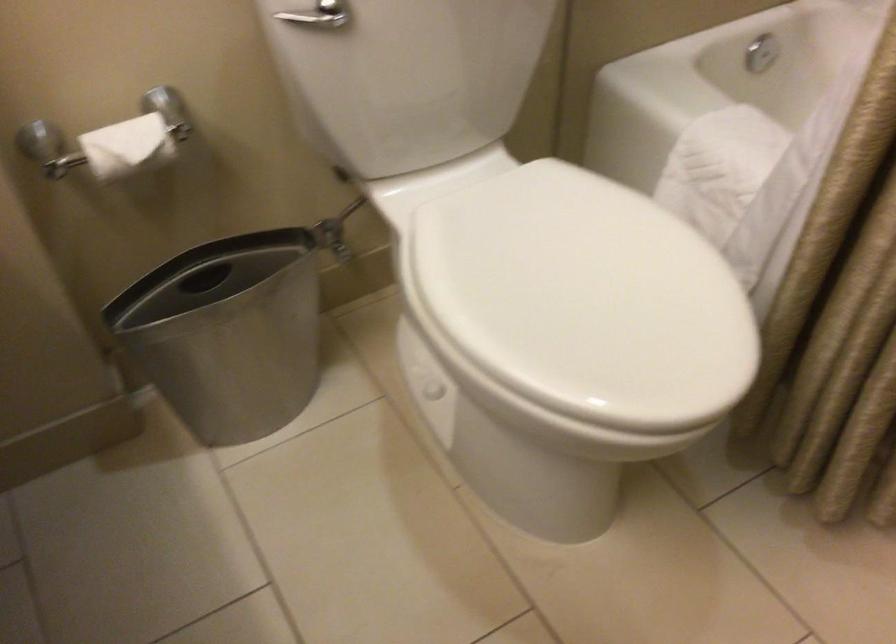
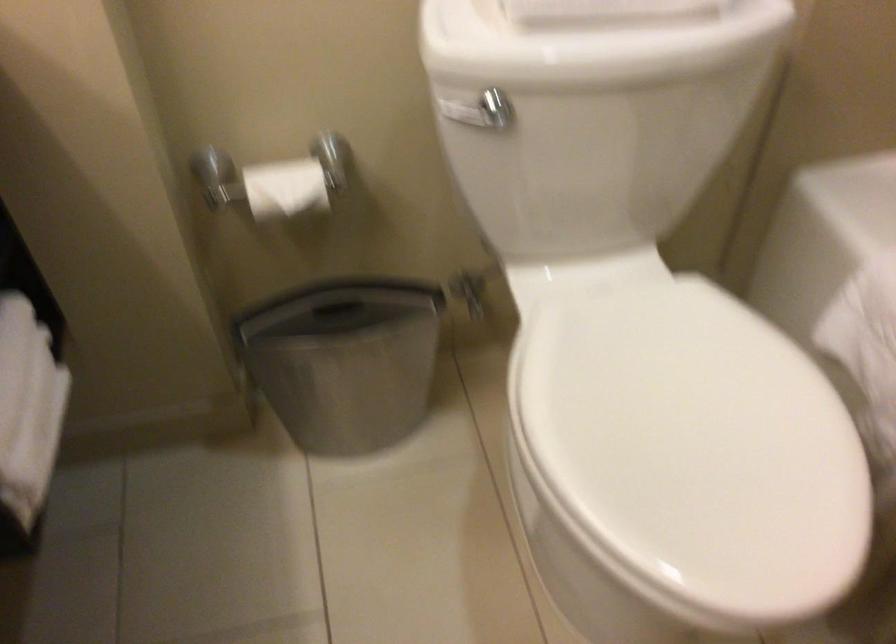
Which direction would the cameraman need to move to produce the second image?

The cameraman moved toward right, forward.